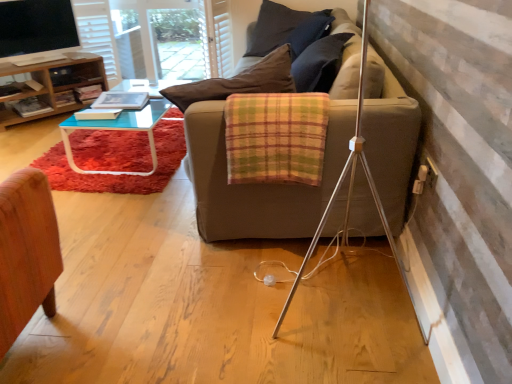
Question: Is white textured curtain at upper center bigger than plaid fabric blanket at center?

Choices:
 (A) no
 (B) yes

Answer: (B)

Question: From the image's perspective, would you say white textured curtain at upper center is shown under plaid fabric blanket at center?

Choices:
 (A) yes
 (B) no

Answer: (B)

Question: From a real-world perspective, is white textured curtain at upper center on top of plaid fabric blanket at center?

Choices:
 (A) no
 (B) yes

Answer: (A)

Question: Is white textured curtain at upper center shorter than plaid fabric blanket at center?

Choices:
 (A) no
 (B) yes

Answer: (A)

Question: Is white textured curtain at upper center directly adjacent to plaid fabric blanket at center?

Choices:
 (A) no
 (B) yes

Answer: (A)

Question: Is point (51, 8) closer or farther from the camera than point (318, 132)?

Choices:
 (A) farther
 (B) closer

Answer: (A)

Question: From the image's perspective, relative to plaid fabric blanket at center, is matte black screen at upper left above or below?

Choices:
 (A) below
 (B) above

Answer: (B)

Question: Considering the positions of matte black screen at upper left and plaid fabric blanket at center in the image, is matte black screen at upper left bigger or smaller than plaid fabric blanket at center?

Choices:
 (A) small
 (B) big

Answer: (A)

Question: Is matte black screen at upper left to the left or to the right of plaid fabric blanket at center in the image?

Choices:
 (A) right
 (B) left

Answer: (B)

Question: Based on their positions, is transparent glass screen door at upper left located to the left or right of matte black screen at upper left?

Choices:
 (A) left
 (B) right

Answer: (B)

Question: In terms of width, does transparent glass screen door at upper left look wider or thinner when compared to matte black screen at upper left?

Choices:
 (A) thin
 (B) wide

Answer: (B)

Question: Is transparent glass screen door at upper left bigger or smaller than matte black screen at upper left?

Choices:
 (A) big
 (B) small

Answer: (A)

Question: Relative to matte black screen at upper left, is transparent glass screen door at upper left in front or behind?

Choices:
 (A) behind
 (B) front

Answer: (A)

Question: From their relative heights in the image, would you say plaid fabric blanket at center is taller or shorter than matte black screen at upper left?

Choices:
 (A) short
 (B) tall

Answer: (A)

Question: Based on their sizes in the image, would you say plaid fabric blanket at center is bigger or smaller than matte black screen at upper left?

Choices:
 (A) big
 (B) small

Answer: (A)